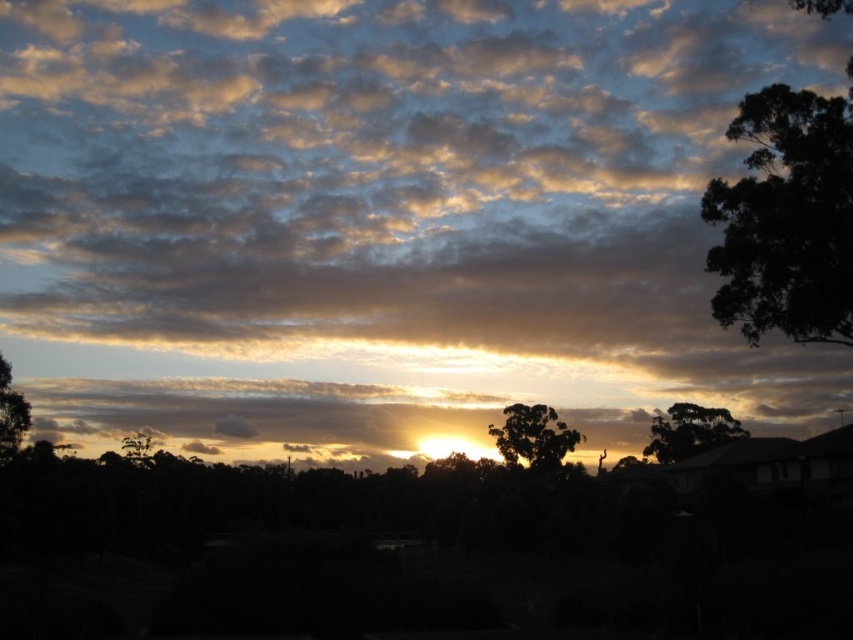
Which is in front, point (305, 340) or point (138, 445)?

Point (138, 445) is more forward.

Who is positioned more to the left, cloudy sky at upper center or green leafy tree at lower left?

green leafy tree at lower left is more to the left.

Identify the location of cloudy sky at upper center. (383, 220).

Measure the distance from green leafy tree at left to green leafy tree at lower left.

green leafy tree at left and green leafy tree at lower left are 137.49 meters apart from each other.

In the scene shown: Measure the distance from green leafy tree at left to green leafy tree at lower left.

green leafy tree at left and green leafy tree at lower left are 137.49 meters apart from each other.

The width and height of the screenshot is (853, 640). What are the coordinates of `green leafy tree at left` in the screenshot? It's located at (10, 413).

Which is below, silhouette tree at center or green leafy tree at left?

silhouette tree at center is lower down.

The height and width of the screenshot is (640, 853). Describe the element at coordinates (532, 436) in the screenshot. I see `silhouette tree at center` at that location.

I want to click on silhouette tree at center, so click(x=532, y=436).